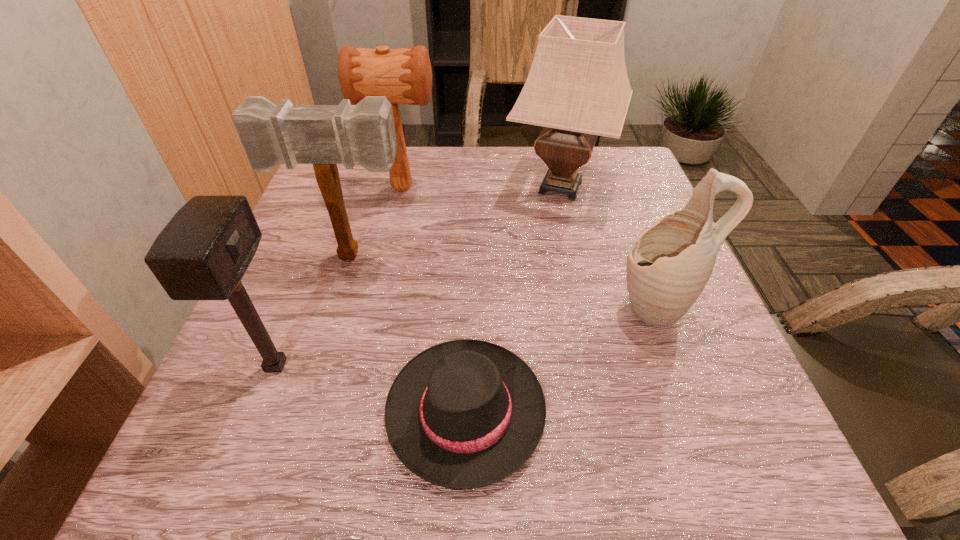
The image size is (960, 540). Identify the location of free region located 0.080m at the spout of the pitcher. (571, 307).

Find the location of a particular element. free space located 0.380m at the spout of the pitcher is located at coordinates (410, 307).

The width and height of the screenshot is (960, 540). Find the location of `free region located at the spout of the pitcher`. free region located at the spout of the pitcher is located at coordinates (588, 307).

You are a GUI agent. You are given a task and a screenshot of the screen. Output one action in this format:
    pyautogui.click(x=<x>, y=<y>)
    Task: Click on the vacant space located on the right of the dress hat
    The height and width of the screenshot is (540, 960).
    Given the screenshot: What is the action you would take?
    pyautogui.click(x=715, y=410)

Where is `lampshade at the far edge`? Image resolution: width=960 pixels, height=540 pixels. lampshade at the far edge is located at coordinates (578, 88).

Image resolution: width=960 pixels, height=540 pixels. I want to click on mallet present at the far edge, so click(404, 76).

Find the location of a particular element. This screenshot has height=540, width=960. object that is positioned at the near edge is located at coordinates (463, 414).

What are the coordinates of `lampshade at the right edge` in the screenshot? It's located at (578, 88).

Locate an element on the screen. This screenshot has width=960, height=540. pitcher present at the right edge is located at coordinates (670, 263).

Identify the location of object situated at the far left corner. (404, 76).